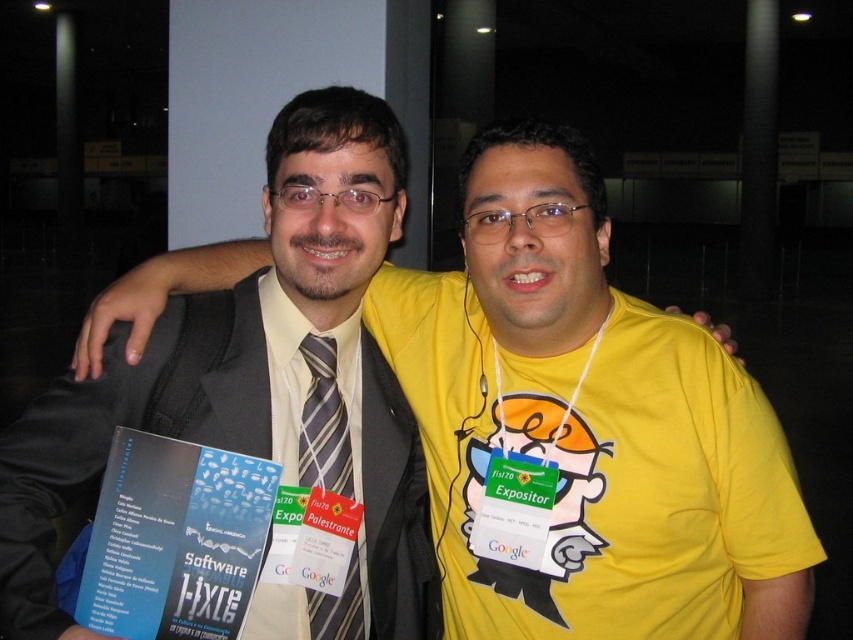
Which of these two, yellow matte shirt at center or striped silk tie at center, stands shorter?

striped silk tie at center

Consider the image. Who is more distant from viewer, (473, 339) or (325, 468)?

Positioned behind is point (473, 339).

Is point (643, 433) behind point (310, 376)?

No, it is in front of (310, 376).

Locate an element on the screen. The width and height of the screenshot is (853, 640). yellow matte shirt at center is located at coordinates tap(589, 422).